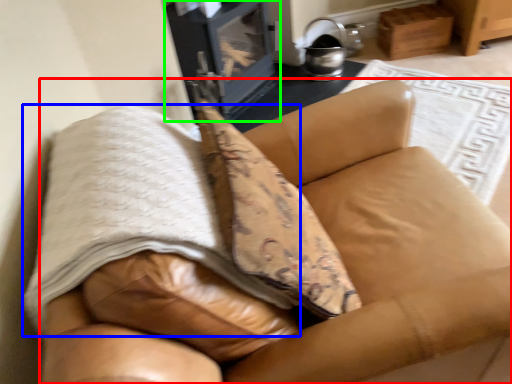
Question: Based on their relative distances, which object is nearer to furniture (highlighted by a red box)? Choose from blanket (highlighted by a blue box) and stove (highlighted by a green box).

Choices:
 (A) blanket
 (B) stove

Answer: (A)